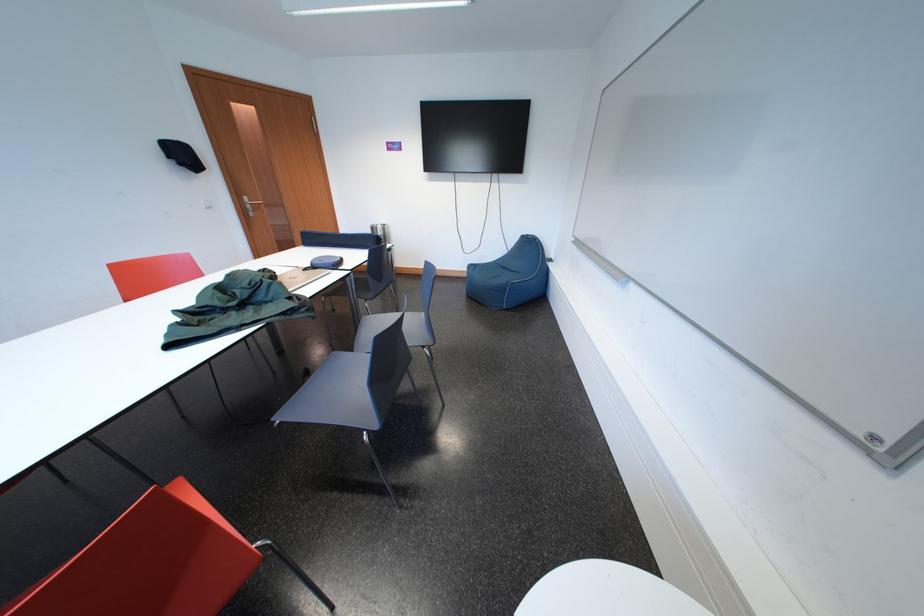
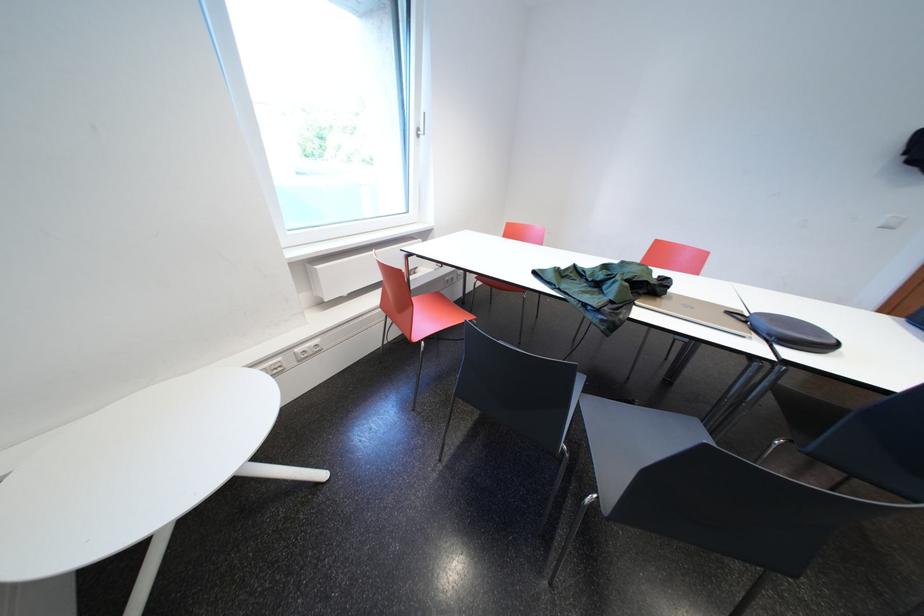
The images are taken continuously from a first-person perspective. In which direction is your viewpoint rotating?

The rotation direction of the camera is left-down.